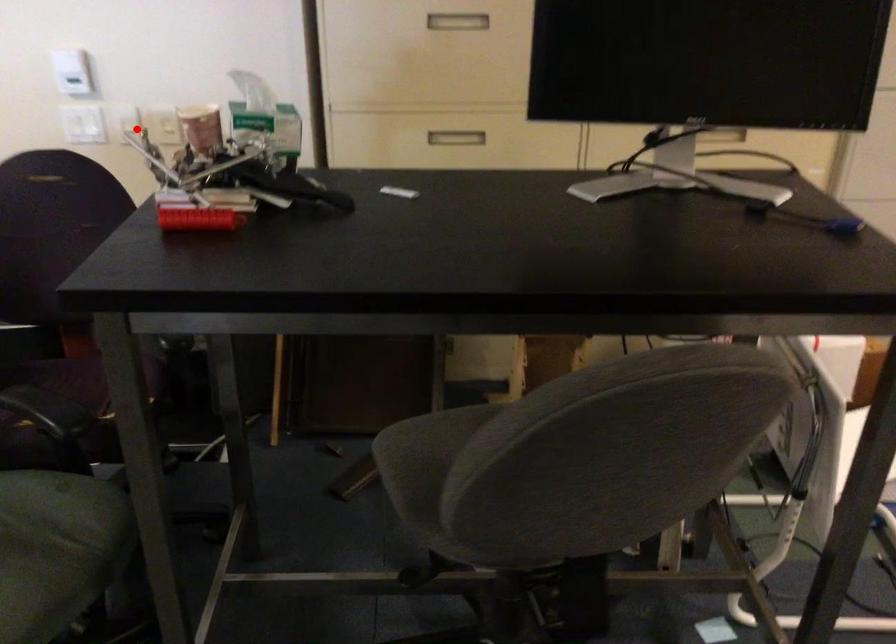
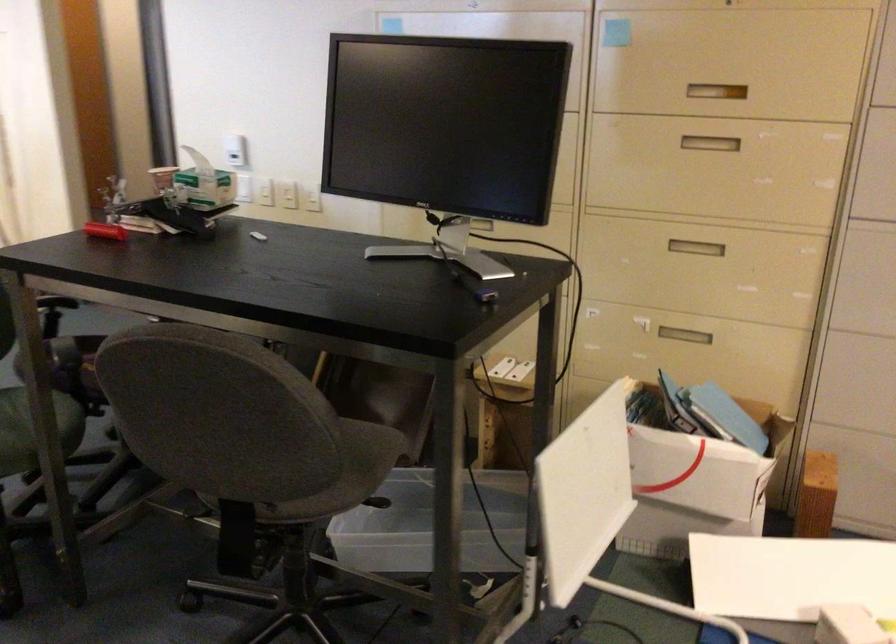
Find the pixel in the second image that matches the highlighted location in the first image.

(264, 192)